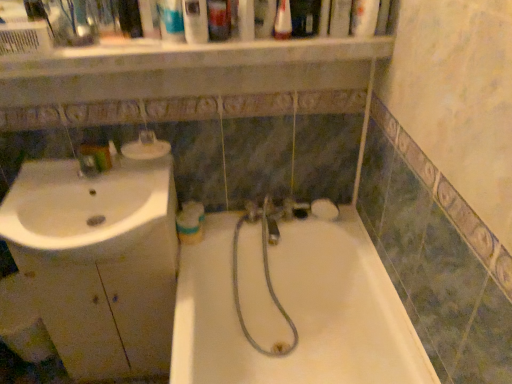
Find the location of `vacant space to the right of matte plastic container at upper left, arranged as the 2th toiletry when viewed from the top`. vacant space to the right of matte plastic container at upper left, arranged as the 2th toiletry when viewed from the top is located at coordinates (147, 175).